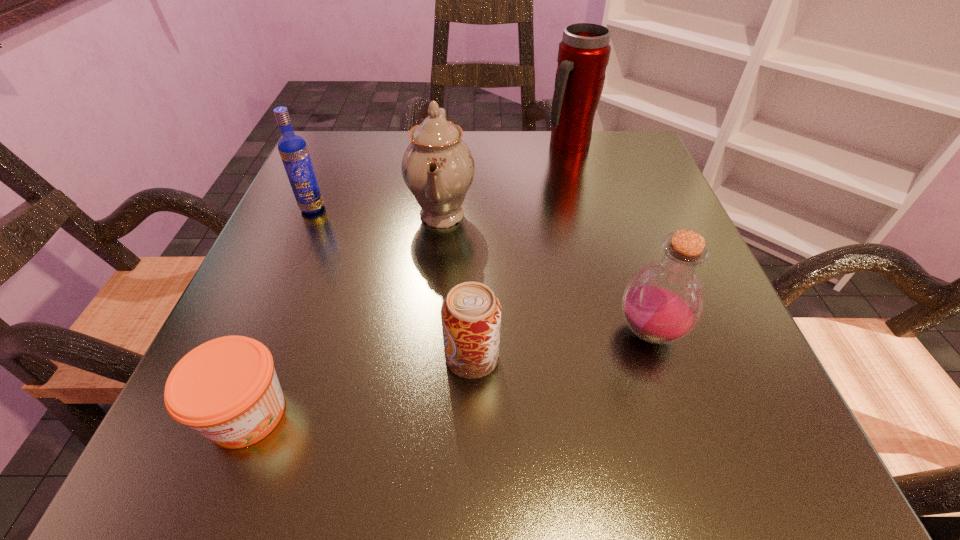
Where is `thermos bottle`? The width and height of the screenshot is (960, 540). thermos bottle is located at coordinates (583, 55).

Where is `chinaware`? The image size is (960, 540). chinaware is located at coordinates (438, 168).

At what (x,y) coordinates should I click in order to perform the action: click on vodka. Please return your answer as a coordinate pair (x, y). Looking at the image, I should click on (293, 150).

Where is `bottle`? Image resolution: width=960 pixels, height=540 pixels. bottle is located at coordinates (663, 301).

Where is `beer can`? Image resolution: width=960 pixels, height=540 pixels. beer can is located at coordinates (x=470, y=314).

You are a GUI agent. You are given a task and a screenshot of the screen. Output one action in this format:
    pyautogui.click(x=<x>, y=<y>)
    Task: Click on the shortest object
    
    Given the screenshot: What is the action you would take?
    pyautogui.click(x=226, y=389)

At what (x,y) coordinates should I click in order to perform the action: click on vacant space situated on the side with the handle of the thermos bottle. Please return your answer as a coordinate pair (x, y). Looking at the image, I should click on (592, 232).

I want to click on vacant space situated on the spout of the chinaware, so click(572, 215).

Find the location of a particular element. The image size is (960, 540). vacant area situated 0.400m on the right of the vodka is located at coordinates (536, 208).

Locate an element on the screen. Image resolution: width=960 pixels, height=540 pixels. free spot located on the back of the bottle is located at coordinates (593, 163).